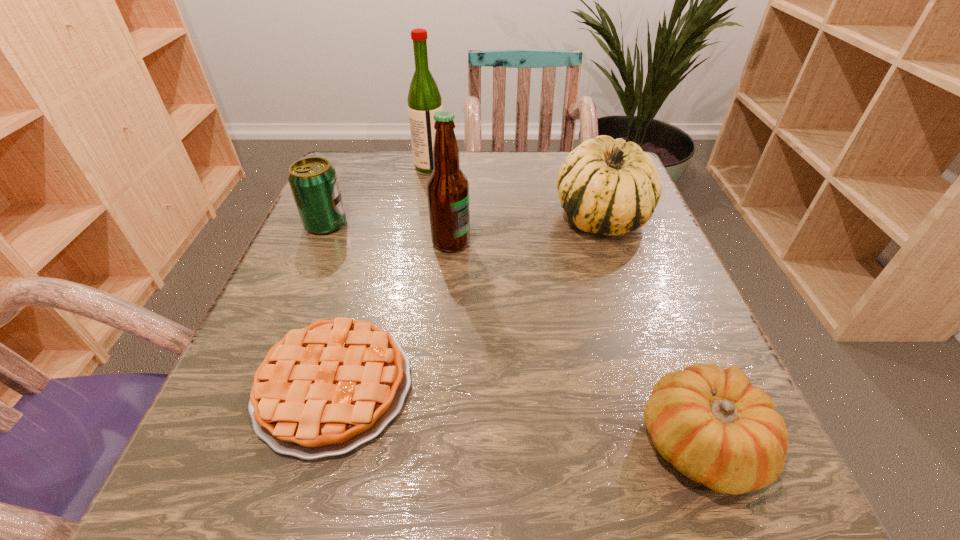
Where is `blank space that satisfies the following two spatial constraints: 1. on the label of the tallest object; 2. on the left side of the third tallest object`? Image resolution: width=960 pixels, height=540 pixels. blank space that satisfies the following two spatial constraints: 1. on the label of the tallest object; 2. on the left side of the third tallest object is located at coordinates (421, 217).

Where is `free spot that satisfies the following two spatial constraints: 1. on the front side of the shorter gourd; 2. on the left side of the shortest object`? This screenshot has height=540, width=960. free spot that satisfies the following two spatial constraints: 1. on the front side of the shorter gourd; 2. on the left side of the shortest object is located at coordinates (318, 443).

Locate an element on the screen. vacant area that satisfies the following two spatial constraints: 1. on the back side of the taller gourd; 2. on the left side of the shortest object is located at coordinates (381, 217).